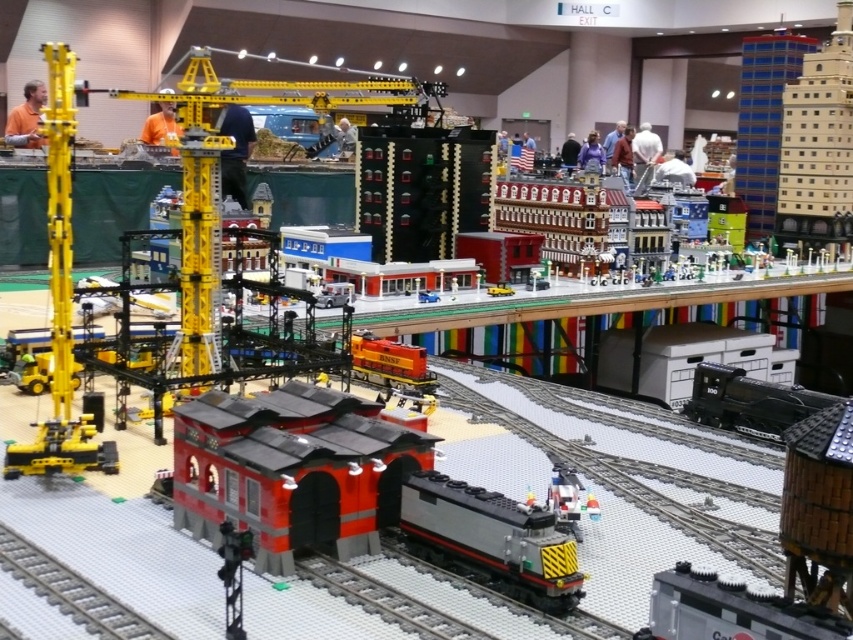
Based on the provided coordinates, where exactly is the gray metallic train at center located in the image?

The gray metallic train at center is located at point coordinates of (492, 538).

You are a visitor at the Lego train exhibition. You see the metallic silver train at center. Can you determine its exact location in the coordinate system of the image?

The metallic silver train at center is located at coordinate point (311,474).